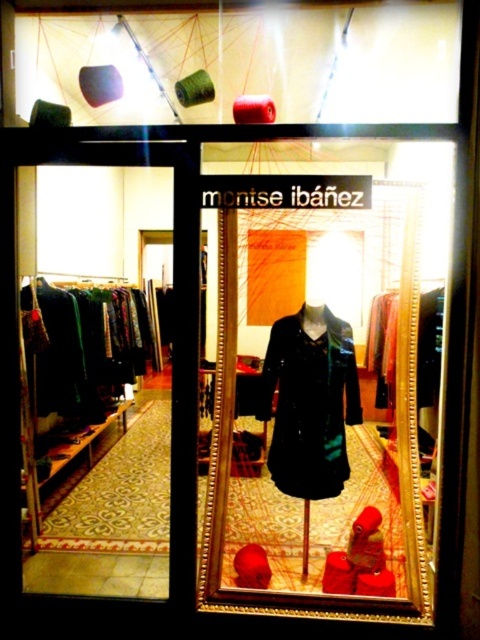
Question: Which object is farther from the camera taking this photo?

Choices:
 (A) green fabric dress at left
 (B) velvet-like dark green coat at center

Answer: (A)

Question: Can you confirm if velvet-like dark green coat at center is positioned to the left of green fabric dress at left?

Choices:
 (A) yes
 (B) no

Answer: (B)

Question: Is velvet-like dark green coat at center below green fabric dress at left?

Choices:
 (A) no
 (B) yes

Answer: (B)

Question: Does velvet-like dark green coat at center appear on the right side of green fabric dress at left?

Choices:
 (A) yes
 (B) no

Answer: (A)

Question: Which point appears closest to the camera in this image?

Choices:
 (A) (84, 369)
 (B) (312, 371)

Answer: (B)

Question: Which point is farther to the camera?

Choices:
 (A) velvet-like dark green coat at center
 (B) green fabric dress at left

Answer: (B)